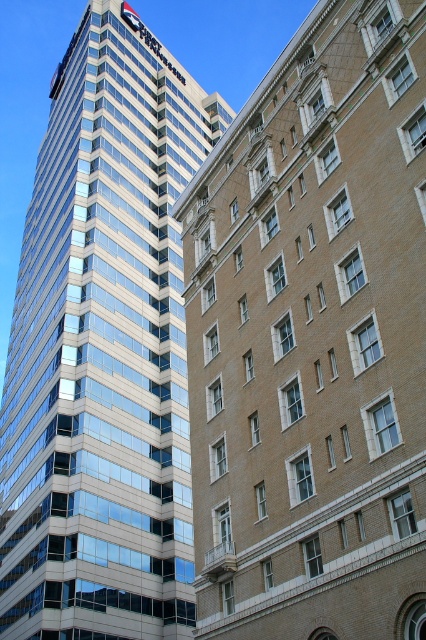
Question: Which of the following is the closest to the observer?

Choices:
 (A) glassy reflective skyscraper at center
 (B) beige brick building at center

Answer: (B)

Question: Which object is closer to the camera taking this photo?

Choices:
 (A) glassy reflective skyscraper at center
 (B) beige brick building at center

Answer: (B)

Question: Can you confirm if beige brick building at center is positioned above glassy reflective skyscraper at center?

Choices:
 (A) yes
 (B) no

Answer: (B)

Question: Does beige brick building at center have a smaller size compared to glassy reflective skyscraper at center?

Choices:
 (A) no
 (B) yes

Answer: (B)

Question: Which point is closer to the camera taking this photo?

Choices:
 (A) (293, 132)
 (B) (51, 97)

Answer: (A)

Question: Is beige brick building at center above glassy reflective skyscraper at center?

Choices:
 (A) no
 (B) yes

Answer: (A)